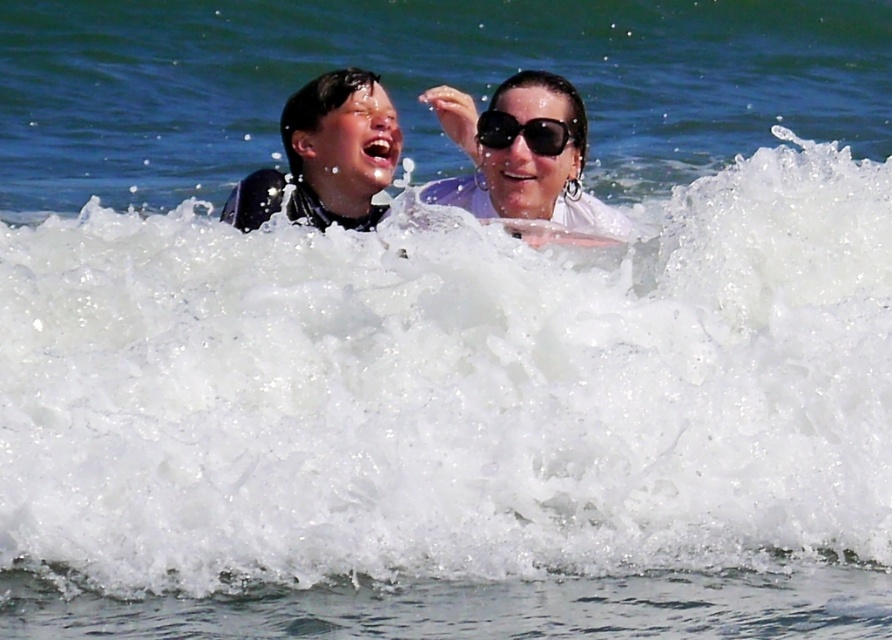
Question: Is white matte sunglasses at upper center to the right of black matte wetsuit at left from the viewer's perspective?

Choices:
 (A) yes
 (B) no

Answer: (A)

Question: Can you confirm if black matte wetsuit at left is wider than black plastic sunglasses at upper center?

Choices:
 (A) yes
 (B) no

Answer: (A)

Question: Does white matte sunglasses at upper center appear over black plastic sunglasses at upper center?

Choices:
 (A) yes
 (B) no

Answer: (A)

Question: Which of the following is the closest to the observer?

Choices:
 (A) (533, 152)
 (B) (249, 200)
 (C) (510, 200)

Answer: (A)

Question: Which object is farther from the camera taking this photo?

Choices:
 (A) black plastic sunglasses at upper center
 (B) white matte sunglasses at upper center
 (C) black matte wetsuit at left

Answer: (A)

Question: Which of the following is the closest to the observer?

Choices:
 (A) white matte sunglasses at upper center
 (B) black matte wetsuit at left

Answer: (A)